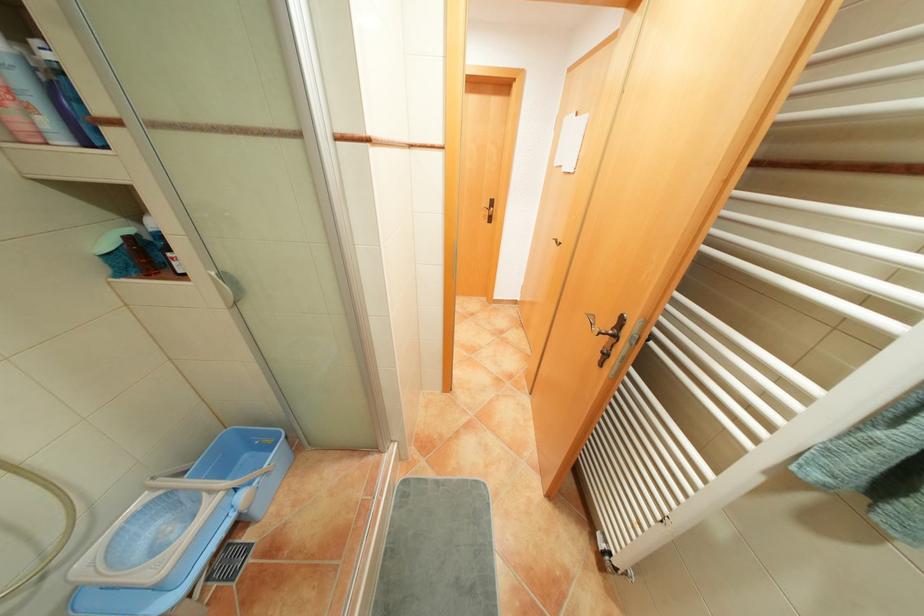
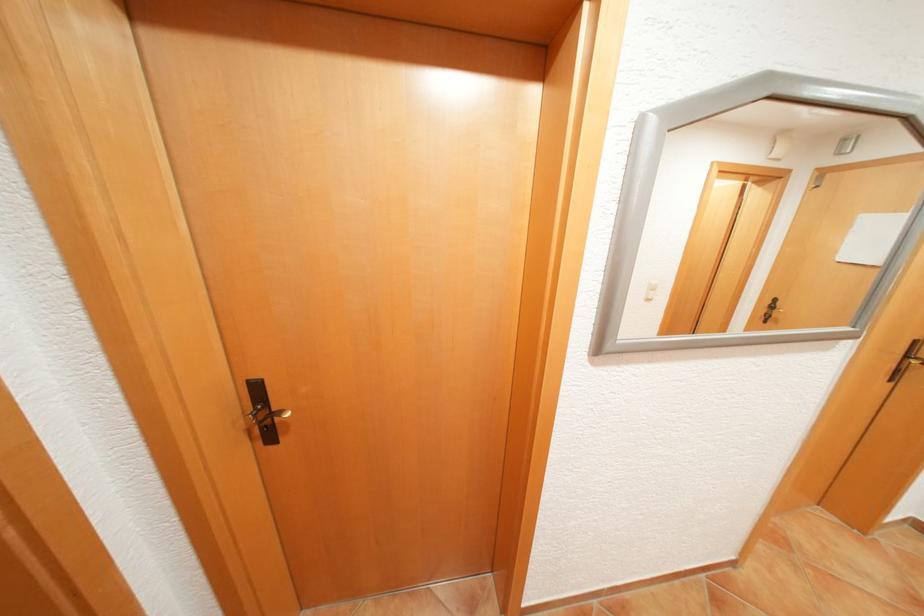
What movement of the cameraman would produce the second image?

The cameraman walked toward left, forward.